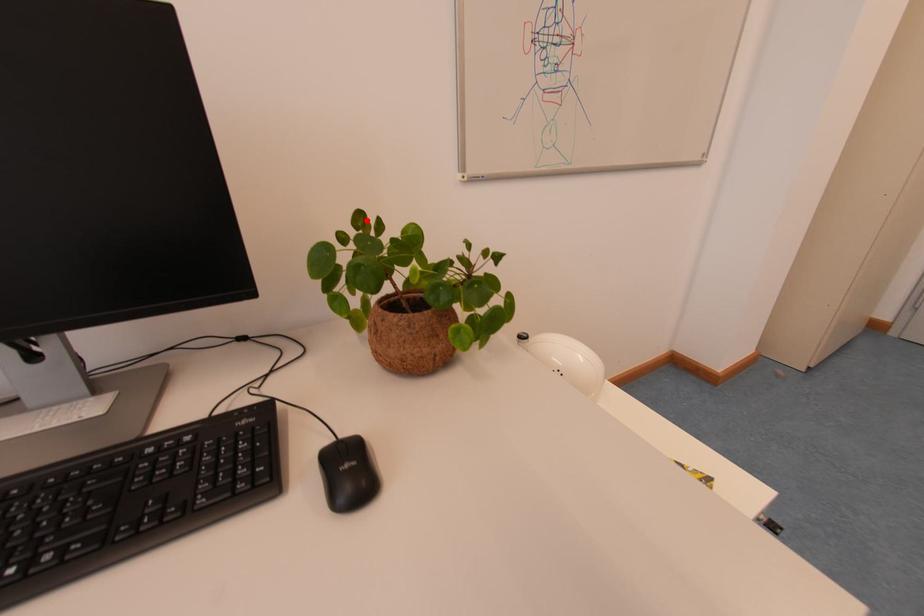
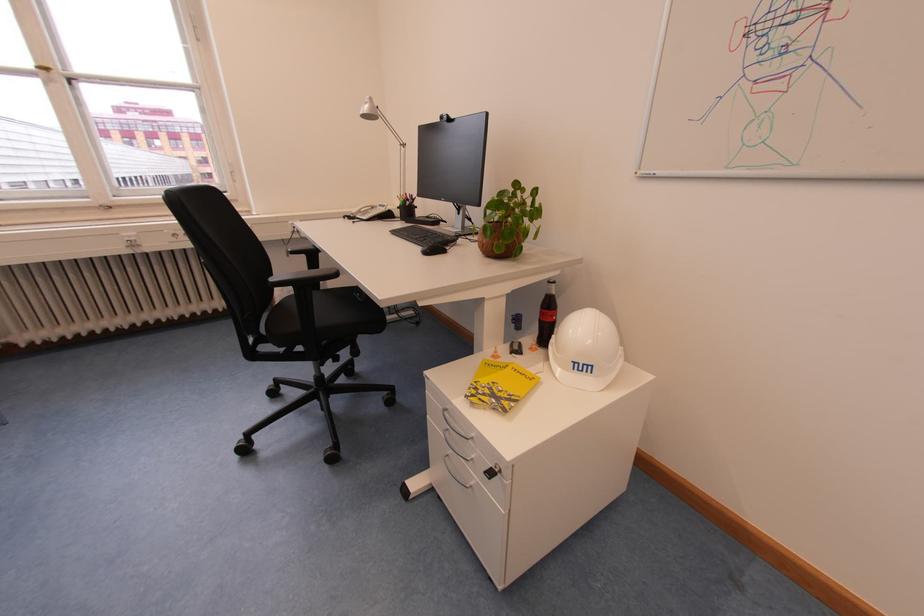
In the second image, find the point that corresponds to the highlighted location in the first image.

(524, 187)